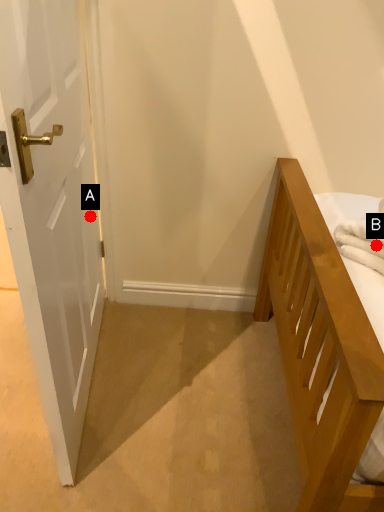
Question: Two points are circled on the image, labeled by A and B beside each circle. Which point is further to the camera?

Choices:
 (A) A is further
 (B) B is further

Answer: (A)